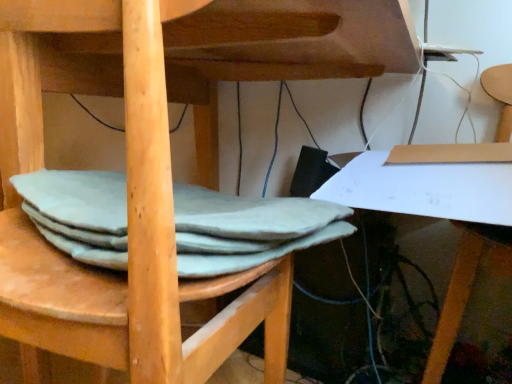
Question: Is matte cardboard chair at lower right wider or thinner than light gray felt at lower left?

Choices:
 (A) thin
 (B) wide

Answer: (B)

Question: In terms of height, does matte cardboard chair at lower right look taller or shorter compared to light gray felt at lower left?

Choices:
 (A) short
 (B) tall

Answer: (B)

Question: Considering their positions, is matte cardboard chair at lower right located in front of or behind light gray felt at lower left?

Choices:
 (A) front
 (B) behind

Answer: (B)

Question: Do you think light gray felt at lower left is within matte cardboard chair at lower right, or outside of it?

Choices:
 (A) inside
 (B) outside

Answer: (B)

Question: Is light gray felt at lower left wider or thinner than matte cardboard chair at lower right?

Choices:
 (A) wide
 (B) thin

Answer: (B)

Question: Visually, is light gray felt at lower left positioned to the left or to the right of matte cardboard chair at lower right?

Choices:
 (A) left
 (B) right

Answer: (A)

Question: From a real-world perspective, relative to matte cardboard chair at lower right, is light gray felt at lower left vertically above or below?

Choices:
 (A) above
 (B) below

Answer: (A)